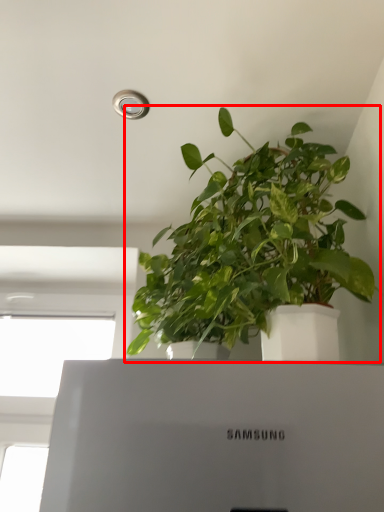
Question: From the image's perspective, where is houseplant (annotated by the red box) located relative to window?

Choices:
 (A) below
 (B) above

Answer: (B)